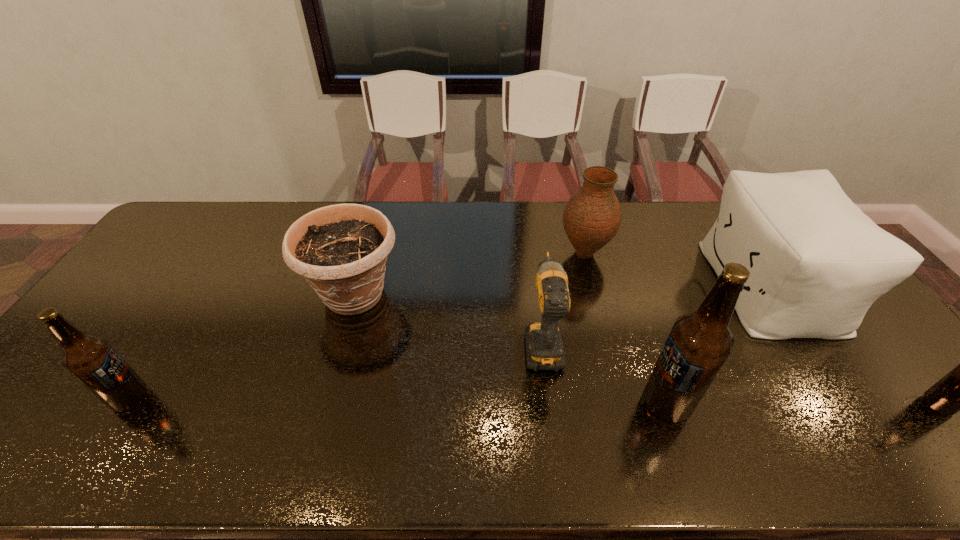
You are a GUI agent. You are given a task and a screenshot of the screen. Output one action in this format:
    pyautogui.click(x=<x>, y=<y>)
    Task: Click on the cushion present at the far edge
    
    Given the screenshot: What is the action you would take?
    pyautogui.click(x=817, y=263)

Identify the location of vase that is positioned at the far edge. The image size is (960, 540). (592, 216).

Where is `object at the right edge`? This screenshot has width=960, height=540. object at the right edge is located at coordinates (817, 263).

Locate an element on the screen. This screenshot has width=960, height=540. object located in the far right corner section of the desktop is located at coordinates (817, 263).

In the image, there is a desktop. Where is `free region at the far edge`? free region at the far edge is located at coordinates (651, 203).

Locate an element on the screen. The image size is (960, 540). blank space at the near edge is located at coordinates (479, 389).

The image size is (960, 540). I want to click on vacant space at the far left corner, so click(x=202, y=216).

This screenshot has height=540, width=960. In order to click on vacant space at the near left corner of the desktop in this screenshot , I will do `click(33, 397)`.

The image size is (960, 540). Find the location of `unoccupied position between the vase and the cushion`. unoccupied position between the vase and the cushion is located at coordinates (677, 269).

At what (x,y) coordinates should I click in order to perform the action: click on vacant area between the second shortest beer bottle and the vase. Please return your answer as a coordinate pair (x, y). This screenshot has width=960, height=540. Looking at the image, I should click on (357, 326).